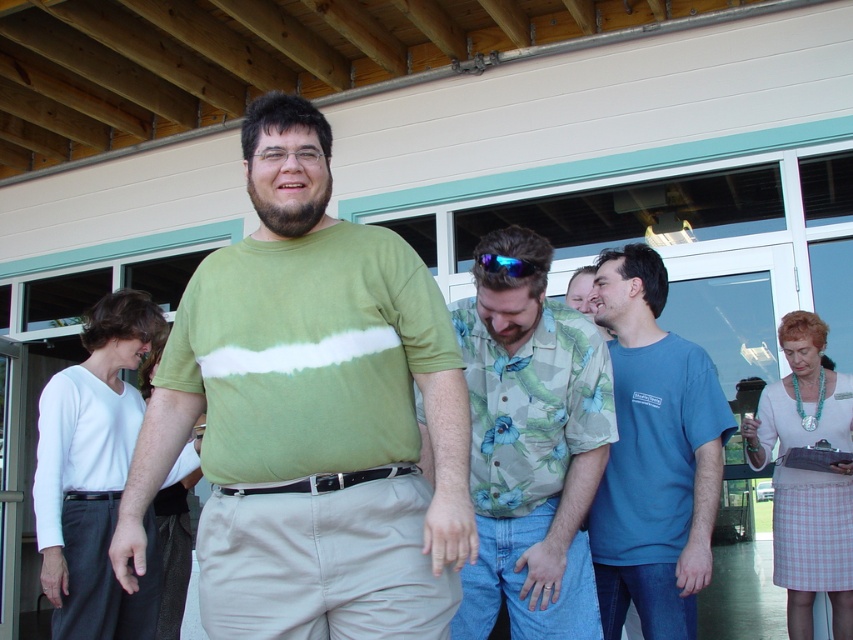
You are standing at the position of point (x=492, y=269) and want to move forward to reach the glass doors. Is there an obstacle directly in front of you at point (x=508, y=236)?

Point (x=508, y=236) is behind point (x=492, y=269), so there is no obstacle directly in front of you at that point when moving toward the glass doors.

You are at an outdoor event and want to find the person wearing the khaki pants at lower right. Which direction should you look relative to the floral print shirt at center?

The khaki pants at lower right is to the right of the floral print shirt at center, so you should look to the right of the floral print shirt at center to find the khaki pants at lower right.

You are a photographer trying to capture a candid shot of the people at the event. You notice the floral print shirt at center and the blue reflective lens at center. Which object should you focus on to ensure the entire subject is in frame if your camera has a limited field of view?

The floral print shirt at center should be focused on since it might be wider than the blue reflective lens at center, allowing the camera to capture the entire subject within the limited field of view.